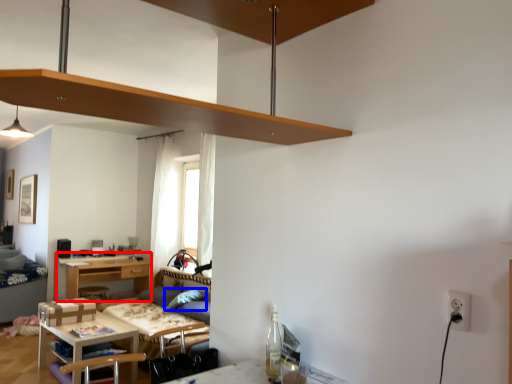
Question: Which object is further to the camera taking this photo, desk (highlighted by a red box) or pillow (highlighted by a blue box)?

Choices:
 (A) desk
 (B) pillow

Answer: (A)